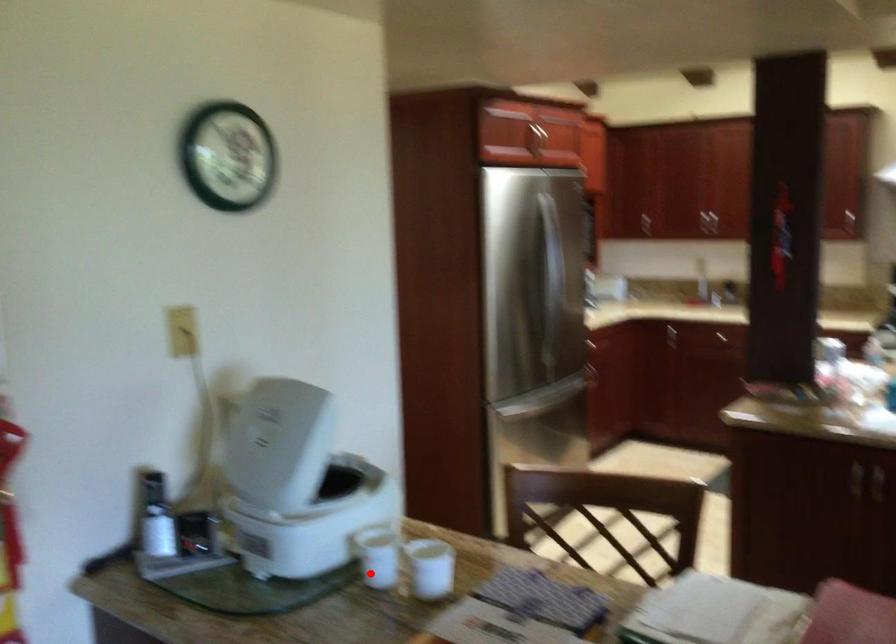
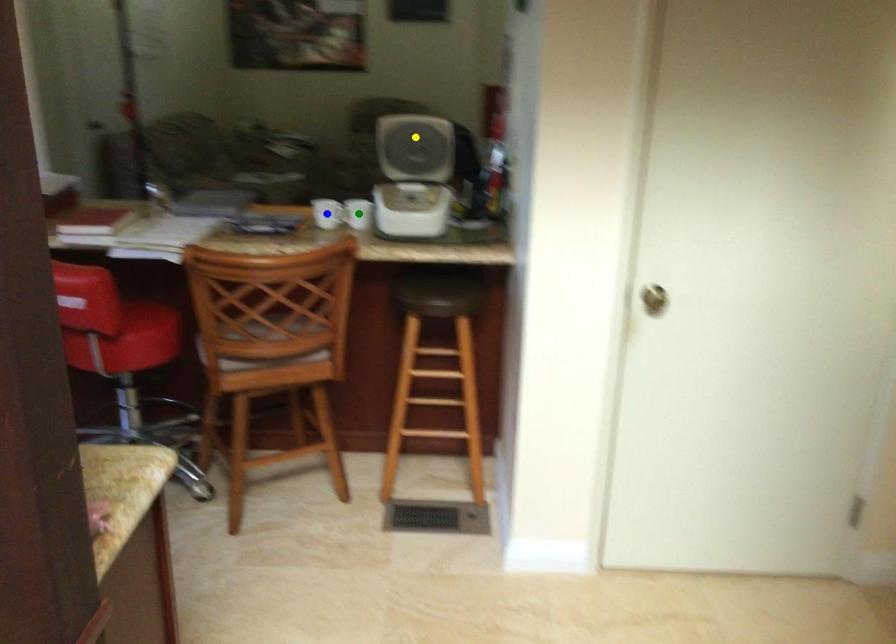
Question: I am providing you with two images of the same scene from different viewpoints. A red point is marked on the first image. You are given multiple points on the second image. Which mark in image 2 goes with the point in image 1?

Choices:
 (A) yellow point
 (B) green point
 (C) blue point

Answer: (B)